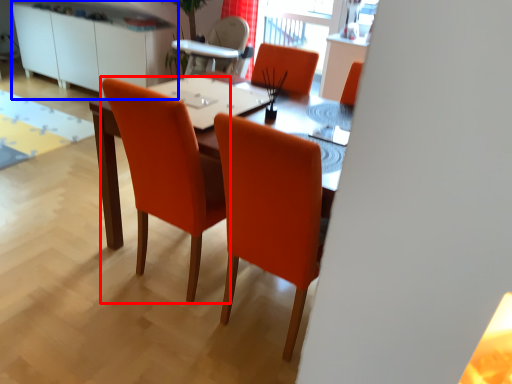
Question: Which point is further to the camera, chair (highlighted by a red box) or dresser (highlighted by a blue box)?

Choices:
 (A) chair
 (B) dresser

Answer: (B)